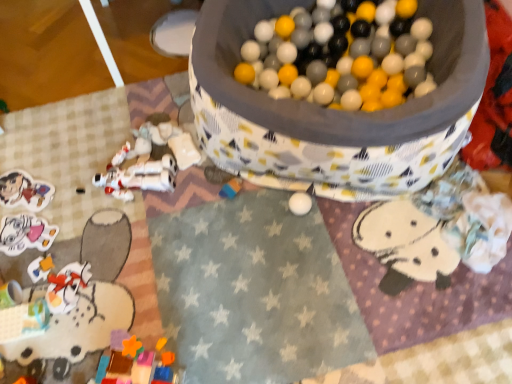
In order to click on free point above plastic toy figure at lower left, placed as the fourth toy when sorted from right to left (from a real-world perspective) in this screenshot , I will do `click(50, 283)`.